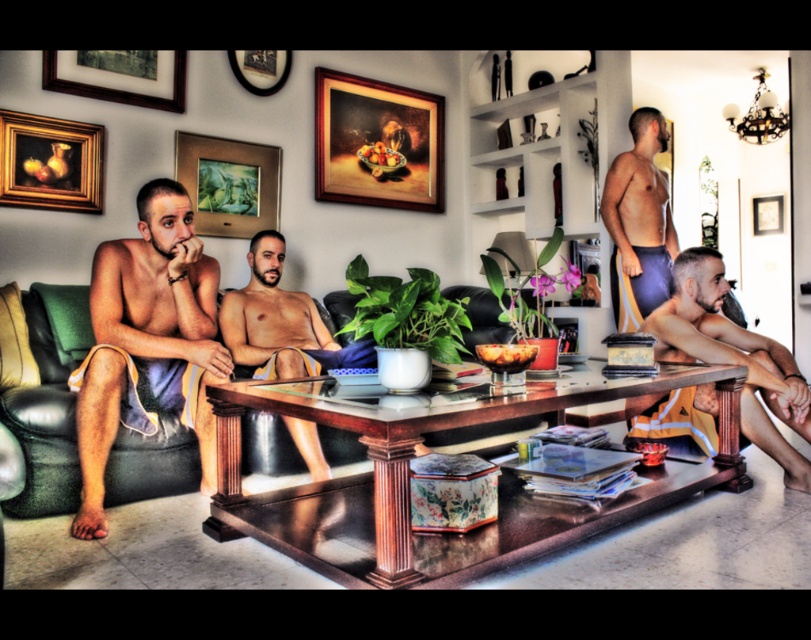
In the living room scene, you see a leather couch at center and matte purple shorts at right. Which object is positioned to the left of the other?

The leather couch at center is to the left of the matte purple shorts at right.

You are a guest in this living room and want to place a book on the table. The book is as wide as the matte purple shorts at right. Can you fit it between the matte towel at left and the edge of the table without overlapping anything?

The matte towel at left is wider than the matte purple shorts at right. Since the book is as wide as the matte purple shorts at right, there should be enough space between the matte towel at left and the table edge to fit the book without overlapping anything.

You are standing in the living room and want to hand a towel to a man wearing matte purple shorts at right. The matte towel at left is currently on the coffee table. Can you reach the towel without moving from your current position?

The matte towel at left is 8.66 feet away from matte purple shorts at right, so you cannot reach the towel without moving since it is too far away.